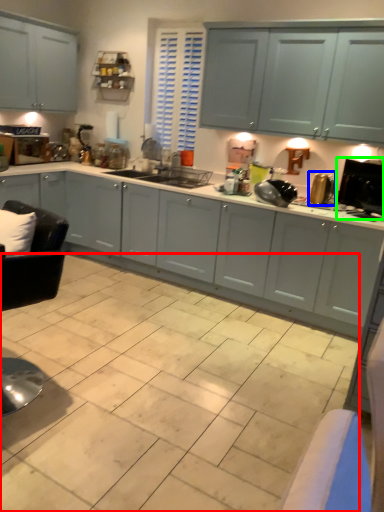
Question: Estimate the real-world distances between objects in this image. Which object is closer to ceramic tile (highlighted by a red box), appliance (highlighted by a blue box) or appliance (highlighted by a green box)?

Choices:
 (A) appliance
 (B) appliance

Answer: (B)